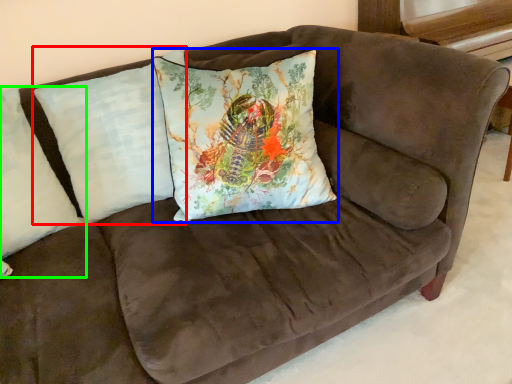
Question: Based on their relative distances, which object is farther from pillow (highlighted by a red box)? Choose from pillow (highlighted by a blue box) and pillow (highlighted by a green box).

Choices:
 (A) pillow
 (B) pillow

Answer: (A)